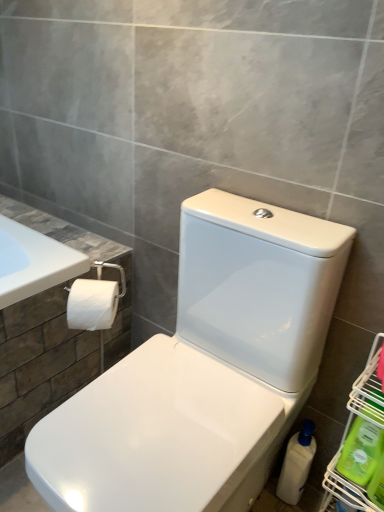
Question: Considering the positions of green plastic bottle at lower right, which is counted as the first cleaning product, starting from the front, and white glossy toilet at center in the image, is green plastic bottle at lower right, which is counted as the first cleaning product, starting from the front, taller or shorter than white glossy toilet at center?

Choices:
 (A) tall
 (B) short

Answer: (B)

Question: Is point (372, 489) closer or farther from the camera than point (160, 412)?

Choices:
 (A) farther
 (B) closer

Answer: (A)

Question: Estimate the real-world distances between objects in this image. Which object is farther from the white plastic bottle at lower right, the third cleaning product viewed from the front?

Choices:
 (A) green plastic bottle at lower right, which is counted as the first cleaning product, starting from the front
 (B) green plastic cleaning product at lower right, which appears as the second cleaning product when viewed from the back
 (C) white matte toilet paper at left
 (D) white glossy toilet at center

Answer: (C)

Question: Which object is positioned closest to the green plastic bottle at lower right, the 3th cleaning product from the back?

Choices:
 (A) white matte toilet paper at left
 (B) green plastic cleaning product at lower right, which appears as the second cleaning product when viewed from the back
 (C) white plastic bottle at lower right, placed as the first cleaning product when sorted from back to front
 (D) white glossy toilet at center

Answer: (B)